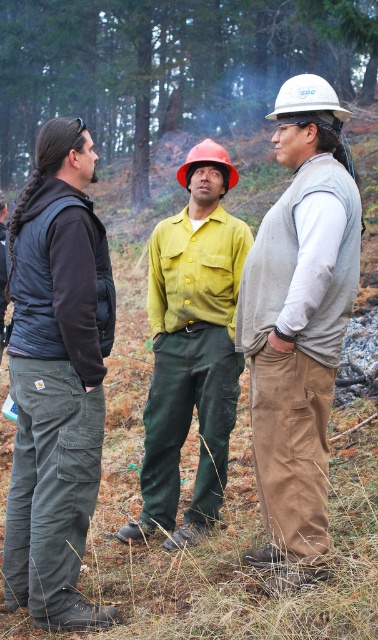
From the picture: Which is below, gray fabric vest at center or orange hard hat at center?

gray fabric vest at center is below.

Who is positioned more to the right, gray fabric vest at center or orange hard hat at center?

gray fabric vest at center

Is point (354, 232) in front of point (204, 140)?

Yes, point (354, 232) is in front of point (204, 140).

The image size is (378, 640). Find the location of `gray fabric vest at center`. gray fabric vest at center is located at coordinates (298, 323).

From the picture: Is white hard hat at center thinner than orange hard hat at center?

No, white hard hat at center is not thinner than orange hard hat at center.

The image size is (378, 640). In order to click on white hard hat at center in this screenshot , I will do `click(306, 97)`.

Between dark gray carhartt pants at left and white hard hat at center, which one has more height?

Standing taller between the two is white hard hat at center.

Which is behind, point (83, 316) or point (314, 100)?

The point (314, 100) is more distant.

Where is `dark gray carhartt pants at left`? dark gray carhartt pants at left is located at coordinates (57, 378).

Where is `dark gray carhartt pants at left`? Image resolution: width=378 pixels, height=640 pixels. dark gray carhartt pants at left is located at coordinates (57, 378).